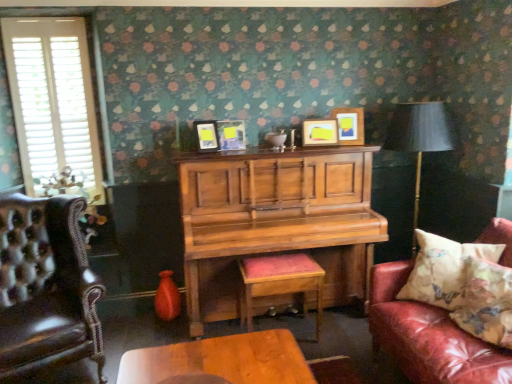
Where is `free location in front of matte black picture frame at center, the first picture frame positioned from the left`? Image resolution: width=512 pixels, height=384 pixels. free location in front of matte black picture frame at center, the first picture frame positioned from the left is located at coordinates (203, 162).